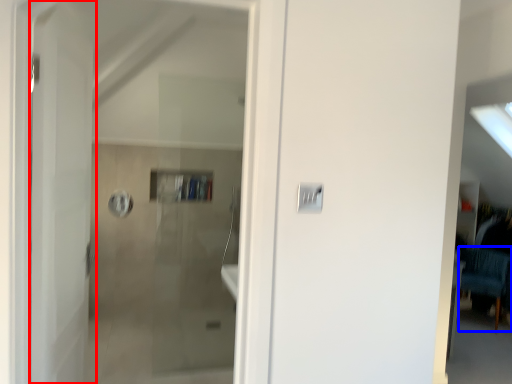
Question: Among these objects, which one is nearest to the camera, door (highlighted by a red box) or furniture (highlighted by a blue box)?

Choices:
 (A) door
 (B) furniture

Answer: (A)